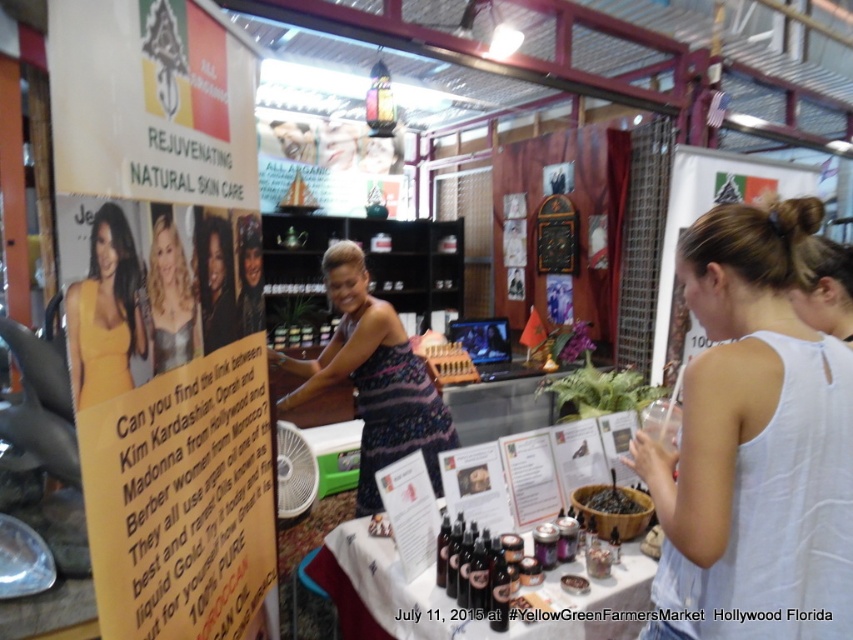
In the scene shown: Is shiny silver dress at center positioned in front of matte black dress at center?

Yes, it is.

Does shiny silver dress at center have a greater height compared to matte black dress at center?

Incorrect, shiny silver dress at center's height is not larger of matte black dress at center's.

Describe the element at coordinates (170, 300) in the screenshot. I see `shiny silver dress at center` at that location.

Locate an element on the screen. The width and height of the screenshot is (853, 640). shiny silver dress at center is located at coordinates (170, 300).

Does white cotton tank top at right appear over dark brown wood bowl at center?

Indeed, white cotton tank top at right is positioned over dark brown wood bowl at center.

In the scene shown: How much distance is there between white cotton tank top at right and dark brown wood bowl at center?

They are 30.26 inches apart.

The height and width of the screenshot is (640, 853). I want to click on white cotton tank top at right, so click(753, 444).

Where is `white cotton tank top at right`? The image size is (853, 640). white cotton tank top at right is located at coordinates point(753,444).

Can you confirm if yellow paper sign at upper left is bigger than dark brown wood bowl at center?

Correct, yellow paper sign at upper left is larger in size than dark brown wood bowl at center.

Who is shorter, yellow paper sign at upper left or dark brown wood bowl at center?

Standing shorter between the two is dark brown wood bowl at center.

Is point (177, 28) in front of point (612, 488)?

Yes, it is in front of point (612, 488).

Locate an element on the screen. The height and width of the screenshot is (640, 853). yellow paper sign at upper left is located at coordinates (161, 316).